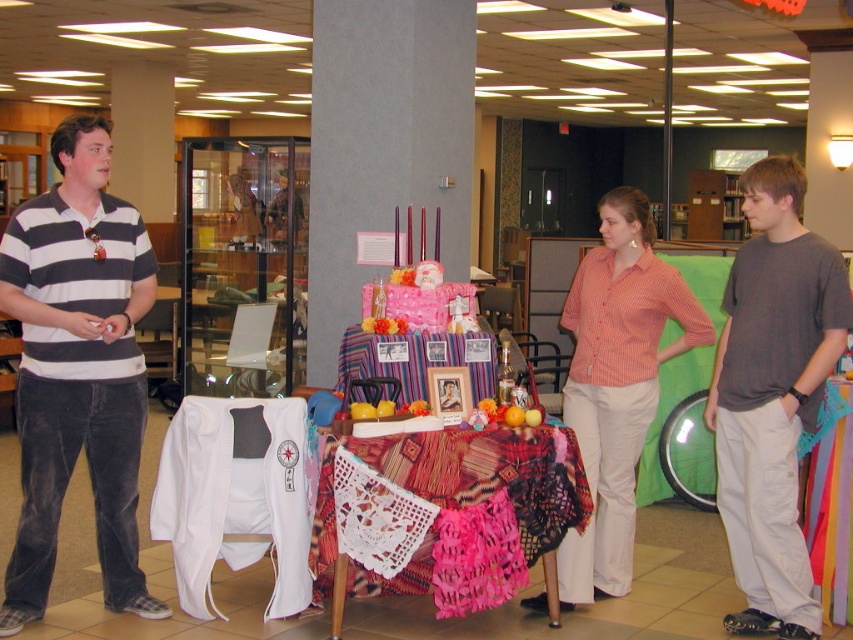
Is gray cotton t-shirt at right wider than striped fabric tablecloth at center?

Incorrect, gray cotton t-shirt at right's width does not surpass striped fabric tablecloth at center's.

Locate an element on the screen. Image resolution: width=853 pixels, height=640 pixels. gray cotton t-shirt at right is located at coordinates (773, 396).

The image size is (853, 640). In order to click on gray cotton t-shirt at right in this screenshot , I will do `click(773, 396)`.

Is orange checkered shirt at center taller than knitted fabric tablecloth at center?

Correct, orange checkered shirt at center is much taller as knitted fabric tablecloth at center.

Does point (577, 323) come closer to viewer compared to point (824, 435)?

No.

Locate an element on the screen. orange checkered shirt at center is located at coordinates (618, 385).

Who is lower down, textured woven cloth at center or striped fabric tablecloth at center?

Positioned lower is textured woven cloth at center.

What do you see at coordinates (463, 512) in the screenshot?
I see `textured woven cloth at center` at bounding box center [463, 512].

The image size is (853, 640). In order to click on textured woven cloth at center in this screenshot , I will do `click(463, 512)`.